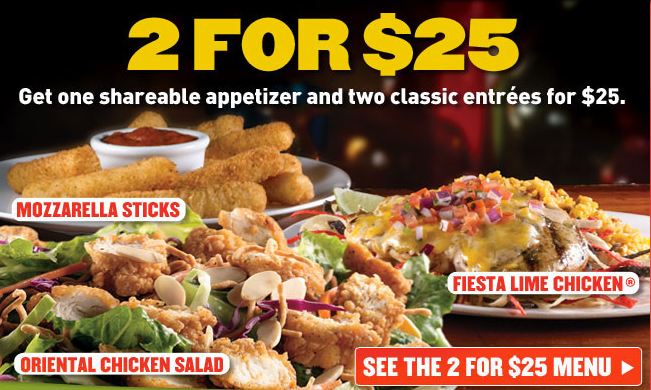
Where is `plate`? The height and width of the screenshot is (390, 651). plate is located at coordinates click(637, 221), click(327, 175).